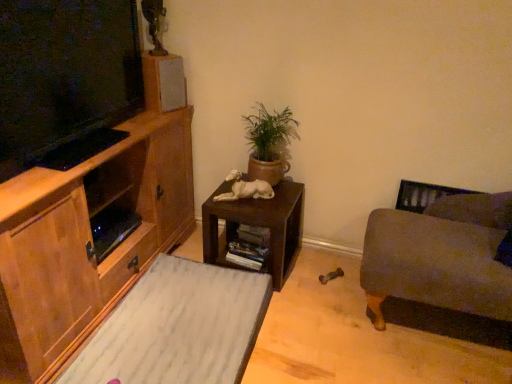
Locate an element on the screen. Image resolution: width=512 pixels, height=384 pixels. vacant area that is in front of white glossy statue at center is located at coordinates (249, 205).